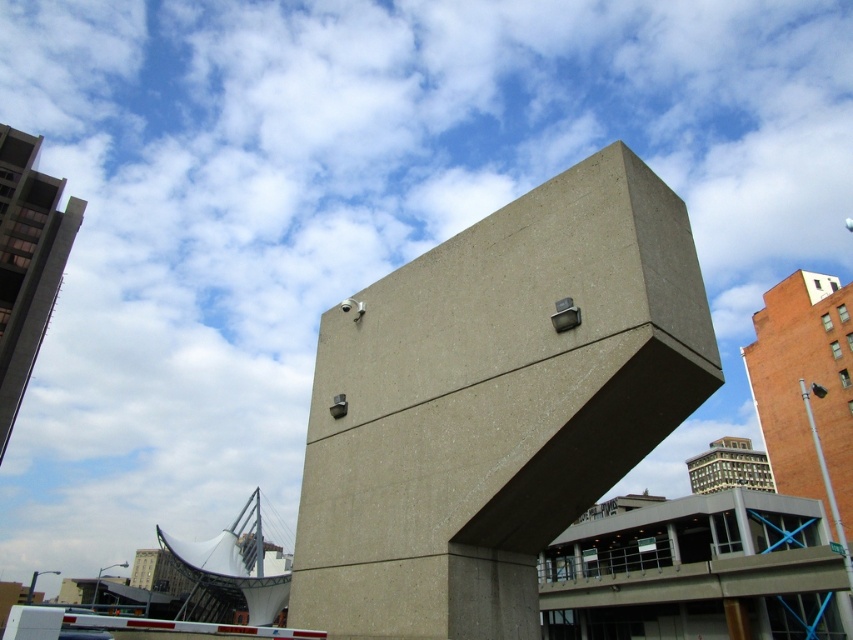
You are an architect evaluating the structural integrity of the gray concrete cube at center and the white fabric sculpture at lower left. Based on their positions, which object is directly above the other?

The gray concrete cube at center is positioned over the white fabric sculpture at lower left, meaning it is directly above it.

You are an urban planner assessing the space between two landmarks in the city. You need to install a new public art installation that requires a minimum of 70 meters of open space between them. Are the gray concrete cube at center and white fabric sculpture at lower left suitable for this installation?

The gray concrete cube at center and white fabric sculpture at lower left are 72.99 meters apart from each other, which exceeds the required 70 meters of open space. Therefore, they are suitable for the installation.

You are an architect designing a new urban plaza and want to place a bench between the gray concrete cube at center and the white fabric sculpture at lower left. Which object should the bench be closer to if you want it to be equidistant from both in terms of their widths?

The bench should be closer to the gray concrete cube at center because it has a smaller width than the white fabric sculpture at lower left, so to be equidistant in terms of their widths, the bench needs to be positioned nearer to the narrower object.